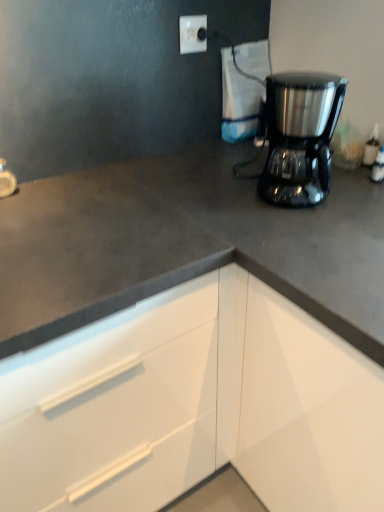
Identify the location of vacant area on the back side of satin black coffee maker at upper right. This screenshot has width=384, height=512. [x=249, y=169].